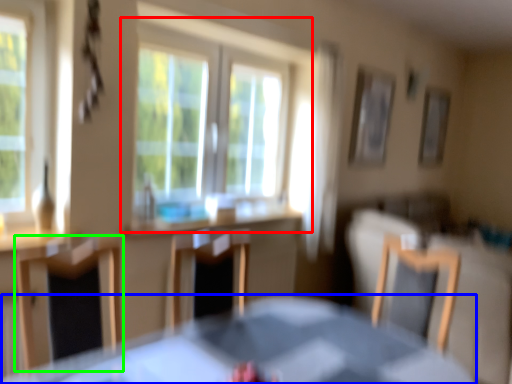
Question: Considering the real-world distances, which object is closest to window (highlighted by a red box)? table (highlighted by a blue box) or chair (highlighted by a green box).

Choices:
 (A) table
 (B) chair

Answer: (B)